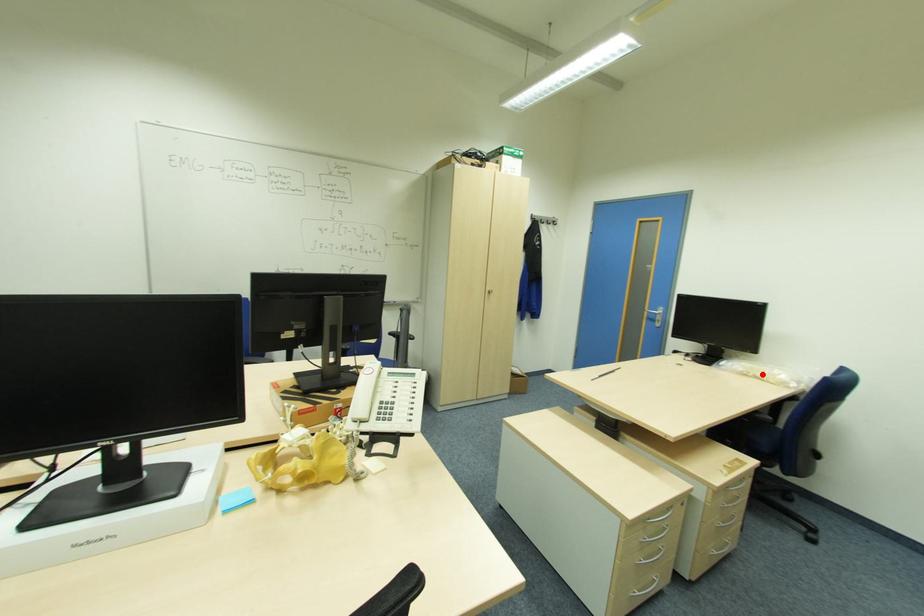
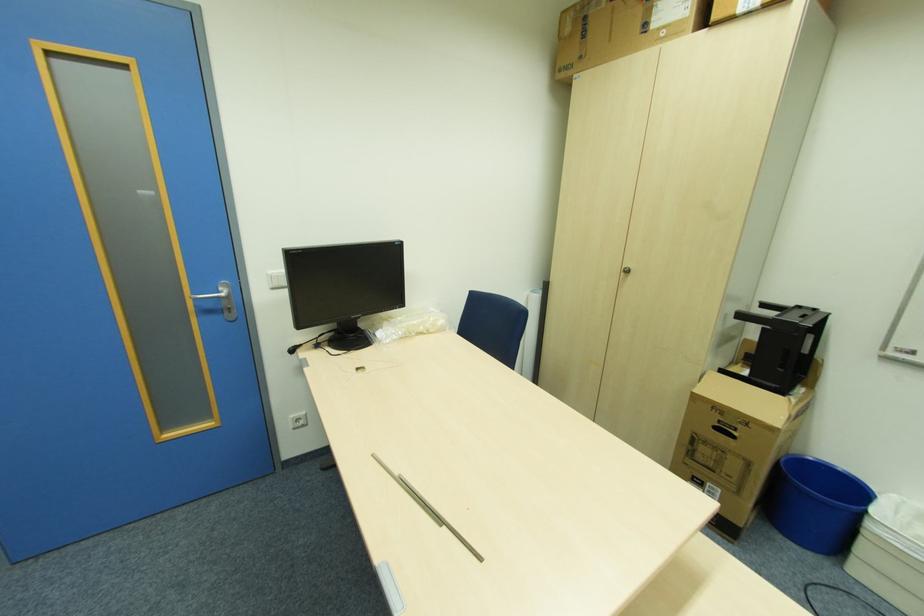
Locate, in the second image, the point that corresponds to the highlighted location in the first image.

(424, 329)